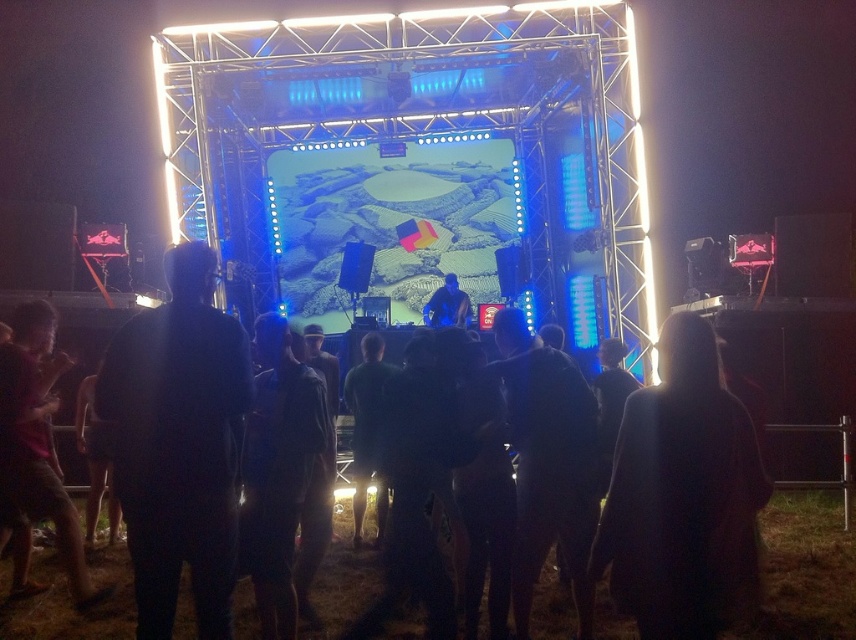
Who is positioned more to the left, dark fabric coat at center or blue fabric dj booth at center?

blue fabric dj booth at center

Between dark fabric coat at center and blue fabric dj booth at center, which one has more height?

With more height is dark fabric coat at center.

Between point (675, 317) and point (462, 316), which one is positioned in front?

Point (675, 317)

You are a GUI agent. You are given a task and a screenshot of the screen. Output one action in this format:
    pyautogui.click(x=<x>, y=<y>)
    Task: Click on the dark fabric coat at center
    This screenshot has height=640, width=856.
    Given the screenshot: What is the action you would take?
    pyautogui.click(x=682, y=497)

Between point (690, 333) and point (82, 564), which one is positioned in front?

Point (690, 333) is more forward.

Where is `dark fabric coat at center`? dark fabric coat at center is located at coordinates 682,497.

Which is in front, point (646, 388) or point (13, 419)?

Point (646, 388)

The width and height of the screenshot is (856, 640). I want to click on dark fabric coat at center, so click(x=682, y=497).

Is dark fabric jacket at center thinner than dark fabric coat at center?

Yes, dark fabric jacket at center is thinner than dark fabric coat at center.

Does dark fabric jacket at center appear on the left side of dark fabric coat at center?

Correct, you'll find dark fabric jacket at center to the left of dark fabric coat at center.

Who is more forward, (111, 381) or (708, 337)?

Positioned in front is point (708, 337).

You are a GUI agent. You are given a task and a screenshot of the screen. Output one action in this format:
    pyautogui.click(x=<x>, y=<y>)
    Task: Click on the dark fabric jacket at center
    
    Given the screenshot: What is the action you would take?
    pyautogui.click(x=177, y=444)